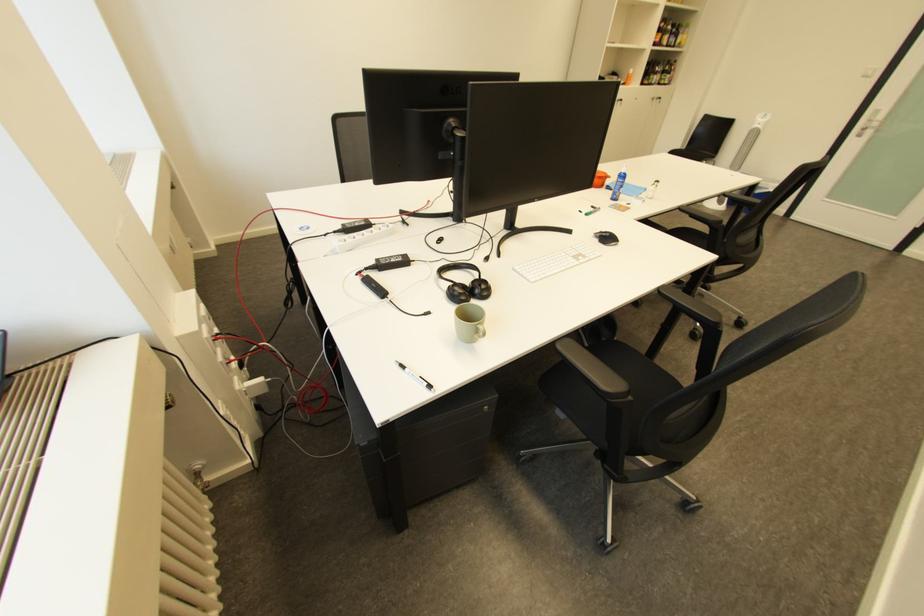
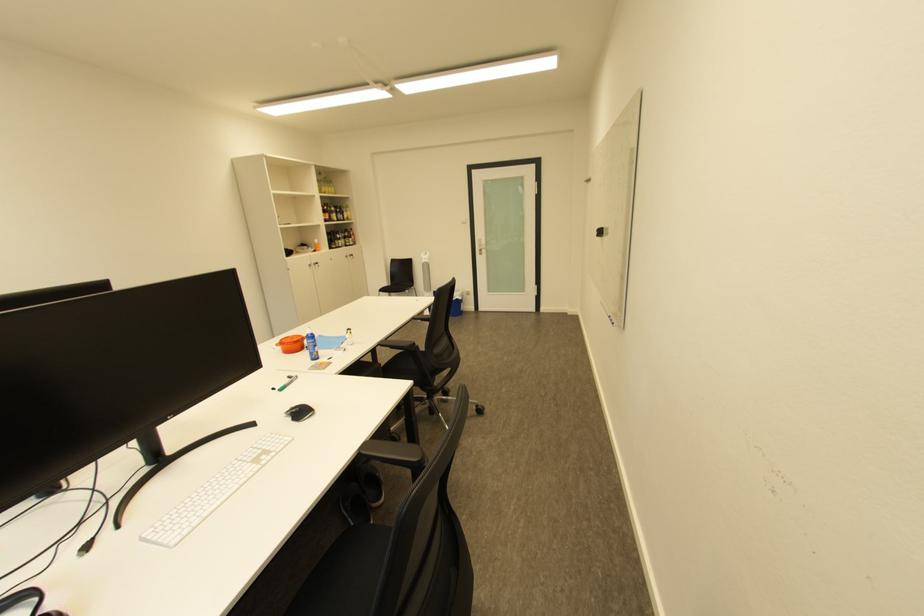
In the second image, find the point that corresponds to (629,103) in the first image.

(329, 267)